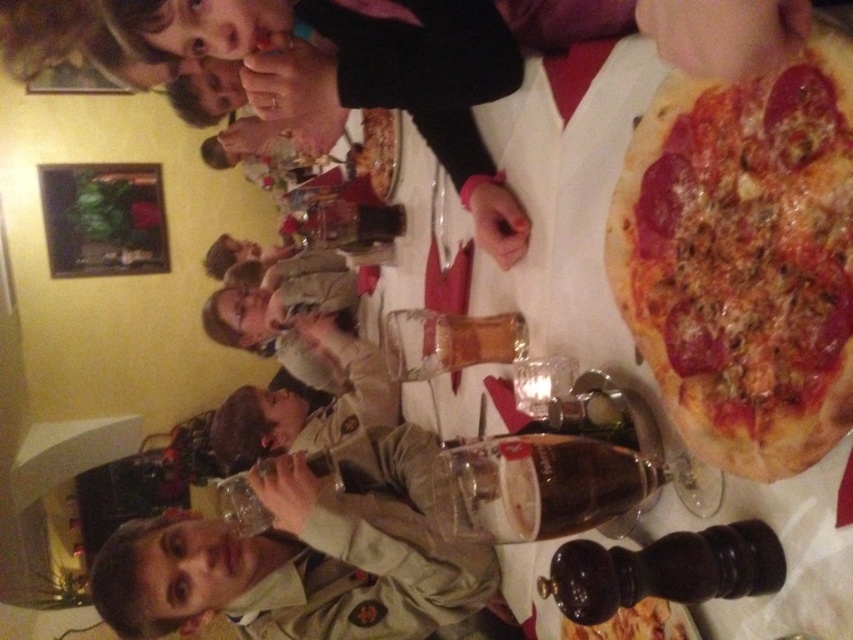
Based on the photo, you are at a restaurant table and want to grab the larger bottle from the center of the table. Which one should you choose between the translucent glass bottle at center and the clear glass bottle at center?

The clear glass bottle at center is larger than the translucent glass bottle at center, so you should choose the clear glass bottle at center.

You are a food critic trying to determine which pizza is taller between the golden brown crusty pizza at right and the golden crispy pizza at upper right. Based on the scene description, which pizza has a greater height?

The golden brown crusty pizza at right has a greater height compared to the golden crispy pizza at upper right.

You are looking at the tilted image of a social gathering. Where is the smooth black shirt at upper center located in terms of its 2D coordinates?

The smooth black shirt at upper center is located at the 2D coordinates of point (x=358, y=76).